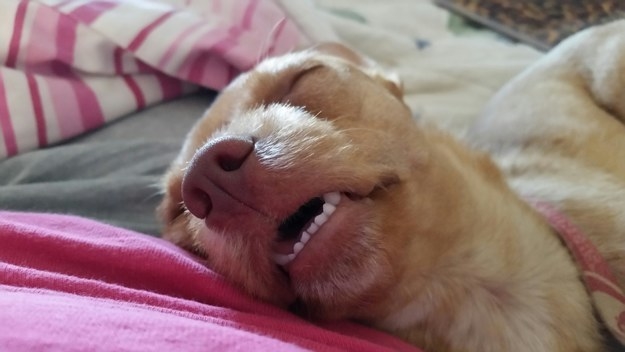
Locate an element on the screen. pink striped bed sheet is located at coordinates [x=82, y=94], [x=198, y=34].